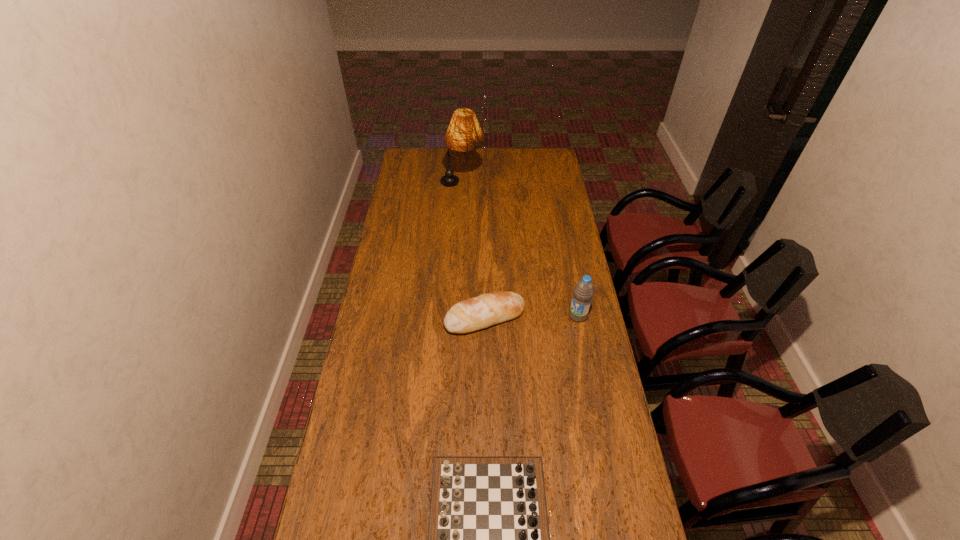
Where is `free spot at the left edge of the desktop`? This screenshot has height=540, width=960. free spot at the left edge of the desktop is located at coordinates (362, 472).

Find the location of a particular element. Image resolution: width=960 pixels, height=540 pixels. free space at the right edge of the desktop is located at coordinates (557, 305).

This screenshot has height=540, width=960. In the image, there is a desktop. What are the coordinates of `vacant space at the far left corner` in the screenshot? It's located at (406, 148).

Image resolution: width=960 pixels, height=540 pixels. Identify the location of vacant region between the lampshade and the bread. (473, 251).

Locate an element on the screen. The width and height of the screenshot is (960, 540). unoccupied position between the farthest object and the bread is located at coordinates (473, 251).

This screenshot has width=960, height=540. Find the location of `empty location between the bread and the lampshade`. empty location between the bread and the lampshade is located at coordinates (473, 251).

Locate an element on the screen. vacant space in between the second shortest object and the tallest object is located at coordinates (473, 251).

Where is `empty location between the bread and the water bottle`? empty location between the bread and the water bottle is located at coordinates (531, 316).

The width and height of the screenshot is (960, 540). What are the coordinates of `vacant area that lies between the rightmost object and the lampshade` in the screenshot? It's located at (520, 250).

What are the coordinates of `vacant area that lies between the bread and the third shortest object` in the screenshot? It's located at (531, 316).